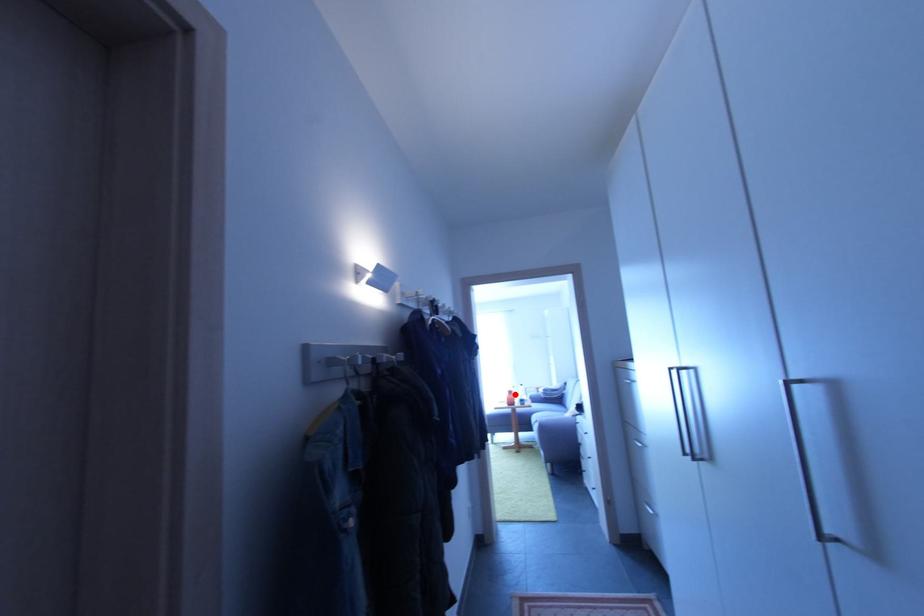
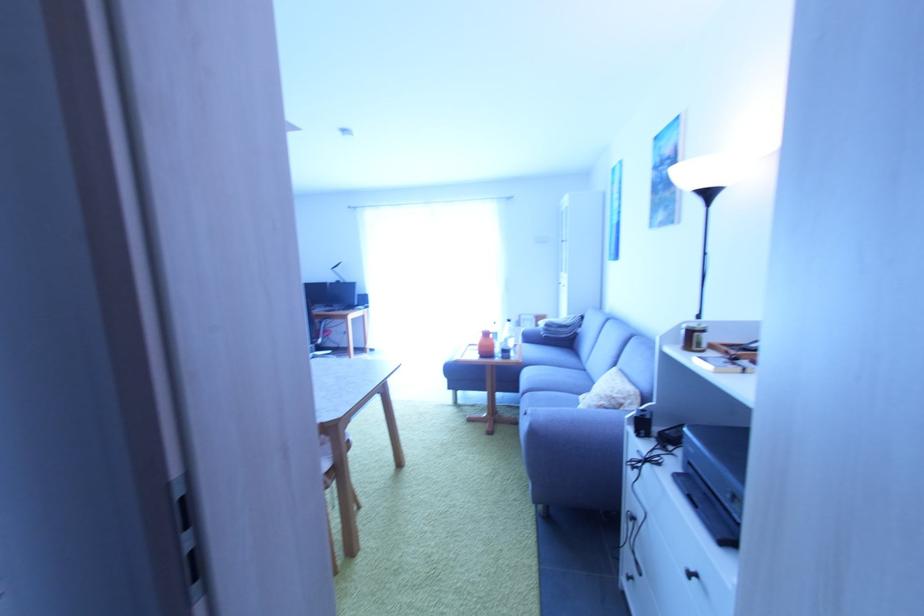
Question: I am providing you with two images of the same scene from different viewpoints. A red point is marked on the first image. At the location where the point appears in image 1, is it still visible in image 2?

Choices:
 (A) Yes
 (B) No

Answer: (A)